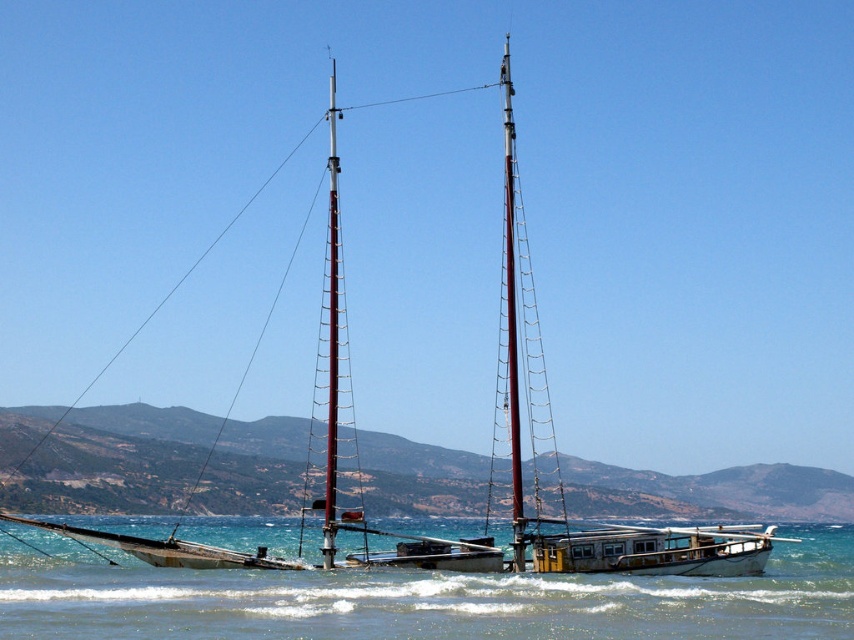
Question: Is smooth wood mast at center thinner than metallic red mast at center?

Choices:
 (A) no
 (B) yes

Answer: (B)

Question: Which object is farther from the camera taking this photo?

Choices:
 (A) clear blue water at center
 (B) metallic red mast at center
 (C) smooth wood mast at center

Answer: (B)

Question: Which of the following is the closest to the observer?

Choices:
 (A) smooth wood mast at center
 (B) metallic red mast at center
 (C) clear blue water at center

Answer: (C)

Question: Considering the real-world distances, which object is closest to the smooth wood mast at center?

Choices:
 (A) clear blue water at center
 (B) metallic red mast at center

Answer: (B)

Question: Considering the relative positions of clear blue water at center and smooth wood mast at center in the image provided, where is clear blue water at center located with respect to smooth wood mast at center?

Choices:
 (A) right
 (B) left

Answer: (A)

Question: Does clear blue water at center appear over metallic red mast at center?

Choices:
 (A) no
 (B) yes

Answer: (A)